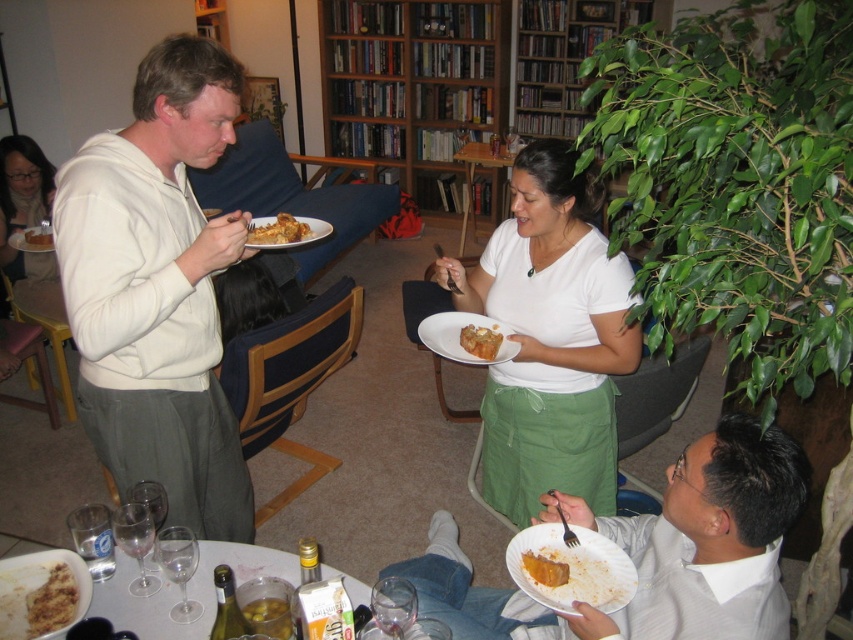
Question: Considering the real-world distances, which object is closest to the yellow matte cake at center?

Choices:
 (A) matte white plate at upper left
 (B) golden brown crumbly pastry at center
 (C) wooden bookshelf at upper center

Answer: (B)

Question: In this image, where is white matte hoodie at upper left located relative to golden brown crumbly pastry at center?

Choices:
 (A) below
 (B) above

Answer: (A)

Question: Which point appears farthest from the camera in this image?

Choices:
 (A) (727, 524)
 (B) (538, 577)
 (C) (28, 240)
 (D) (489, 337)

Answer: (C)

Question: Where is white shirt at lower right located in relation to brown crumbly bread at lower left in the image?

Choices:
 (A) left
 (B) right

Answer: (B)

Question: Which point is closer to the camera?

Choices:
 (A) dirty white plate at lower left
 (B) golden brown flaky pastry at upper center

Answer: (A)

Question: Is wooden bookshelf at upper center positioned before yellow matte cake at center?

Choices:
 (A) yes
 (B) no

Answer: (B)